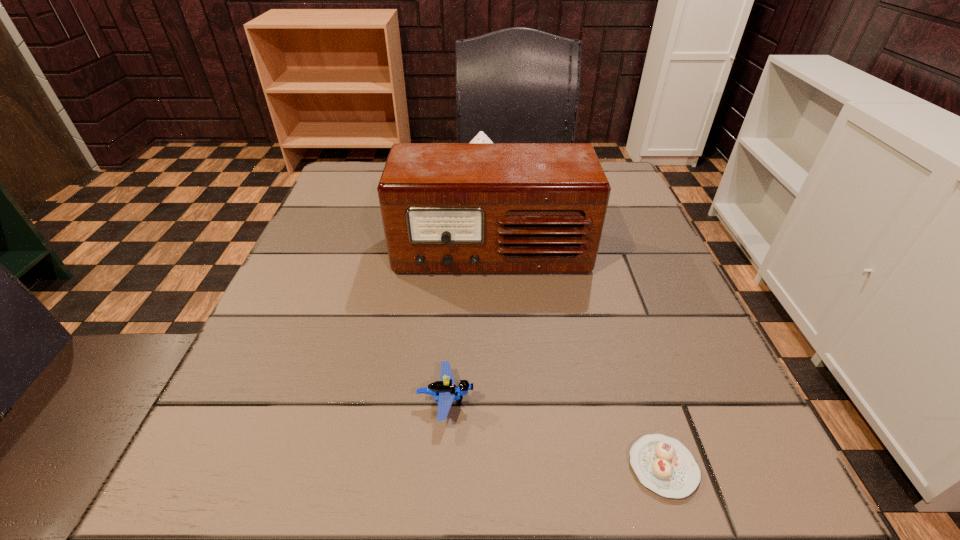
This screenshot has height=540, width=960. Find the location of `free space located on the front-facing side of the second shortest object`. free space located on the front-facing side of the second shortest object is located at coordinates (509, 401).

I want to click on vacant area situated on the left of the nearest object, so click(x=409, y=467).

At what (x,y) coordinates should I click in order to perform the action: click on object positioned at the far edge. Please return your answer as a coordinate pair (x, y). Looking at the image, I should click on (480, 137).

Locate an element on the screen. The width and height of the screenshot is (960, 540). object positioned at the near edge is located at coordinates (664, 465).

You are a GUI agent. You are given a task and a screenshot of the screen. Output one action in this format:
    pyautogui.click(x=<x>, y=<y>)
    Task: Click on the radio receiver that is positioned at the right edge
    
    Given the screenshot: What is the action you would take?
    pyautogui.click(x=447, y=208)

Identify the location of cupcake situated at the right edge. (664, 465).

Locate an element on the screen. object present at the near right corner is located at coordinates (664, 465).

This screenshot has width=960, height=540. Identify the location of blank space at the near edge of the desktop. (379, 500).

Where is `vacant space at the left edge of the desktop`? vacant space at the left edge of the desktop is located at coordinates (317, 390).

In the image, there is a desktop. Where is `vacant space at the right edge`? The image size is (960, 540). vacant space at the right edge is located at coordinates (656, 407).